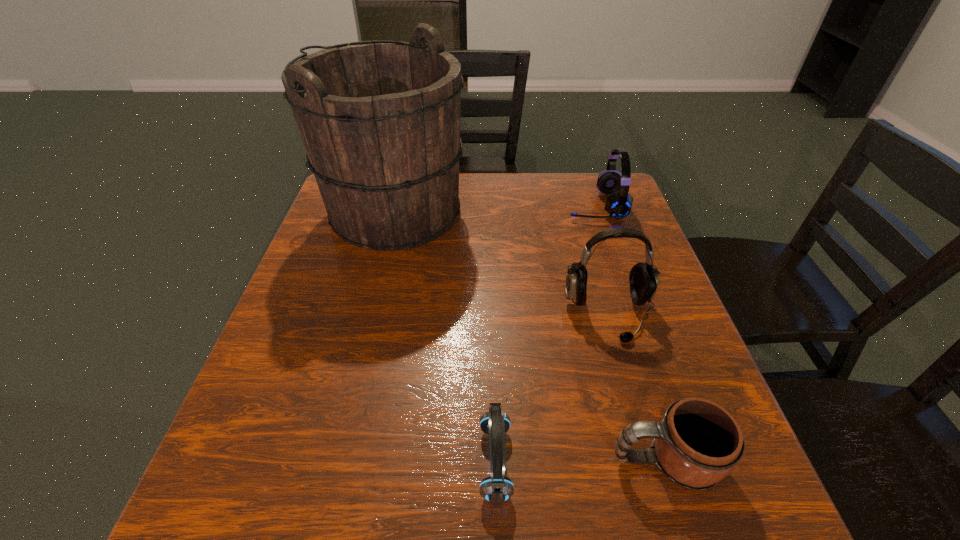
The width and height of the screenshot is (960, 540). I want to click on the leftmost object, so click(380, 120).

This screenshot has width=960, height=540. Identify the location of bucket. [x=380, y=120].

Where is `the third nearest object`? the third nearest object is located at coordinates [x=643, y=279].

What are the coordinates of `the second nearest headset` in the screenshot? It's located at (643, 279).

The width and height of the screenshot is (960, 540). I want to click on the farthest headset, so click(x=618, y=204).

This screenshot has height=540, width=960. Find the location of `the third tallest object`. the third tallest object is located at coordinates coord(618,204).

Locate an element on the screen. The height and width of the screenshot is (540, 960). mug is located at coordinates (697, 443).

Where is `the leftmost headset`? the leftmost headset is located at coordinates (496, 489).

This screenshot has height=540, width=960. Identify the location of the nearest headset. (496, 489).

Identify the location of free region located 0.070m on the right of the bucket. (492, 212).